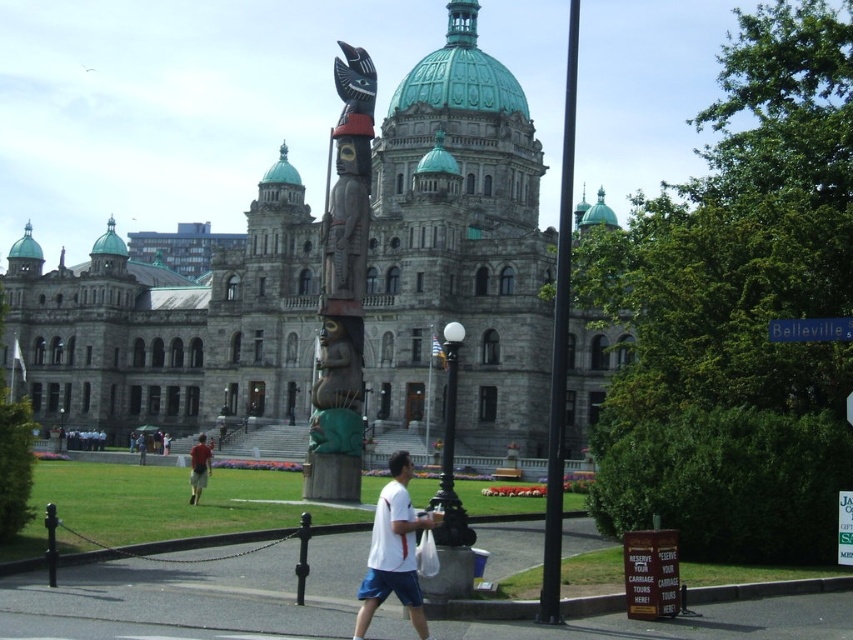
Question: Among these points, which one is nearest to the camera?

Choices:
 (A) (199, 488)
 (B) (384, 508)

Answer: (B)

Question: Is white cotton shirt at center to the left of green plastic street sign at upper right from the viewer's perspective?

Choices:
 (A) yes
 (B) no

Answer: (A)

Question: Which point is farther to the camera?

Choices:
 (A) (444, 433)
 (B) (198, 477)

Answer: (A)

Question: Does black glass lamp post at center lie in front of black metal lamp post at center?

Choices:
 (A) no
 (B) yes

Answer: (B)

Question: Where is smooth black pole at center located in relation to black metal lamp post at center in the image?

Choices:
 (A) left
 (B) right

Answer: (B)

Question: Which is nearer to the black metal lamp post at center?

Choices:
 (A) green plastic street sign at upper right
 (B) white cotton shirt at center
 (C) smooth black pole at center

Answer: (C)